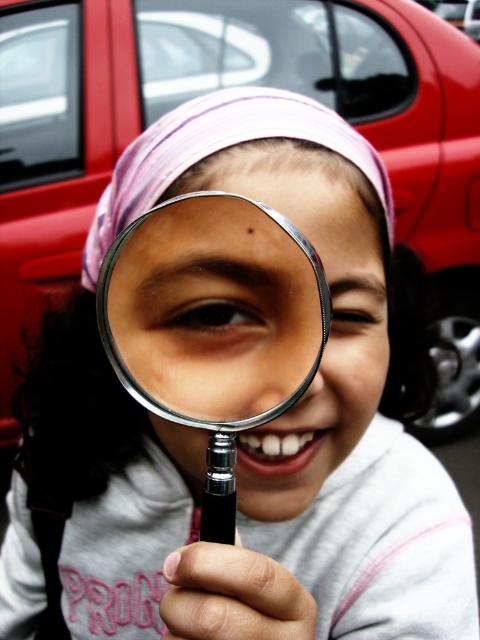
The girl is holding a metallic silver magnifying glass at center and wearing a purple fabric headscarf at center. Which object is positioned lower in the image?

The metallic silver magnifying glass at center is below purple fabric headscarf at center, so the magnifying glass is positioned lower.

You are a photographer trying to capture the girl holding the metallic silver magnifying glass at center. To ensure the magnifying glass is in focus, where should you adjust your camera focus point to? Please provide coordinates based on the image grid system described in the scene.

The metallic silver magnifying glass at center is located at point (213, 310), so you should adjust your camera focus point to coordinates (213, 310) to ensure it is in focus.

Consider the image. The girl is looking through her magnifying glass at the metallic red car at upper center and the purple fabric headscarf at center. Which object is closer to her face?

The metallic red car at upper center is closer to her face because it is further to the viewer than the purple fabric headscarf at center.